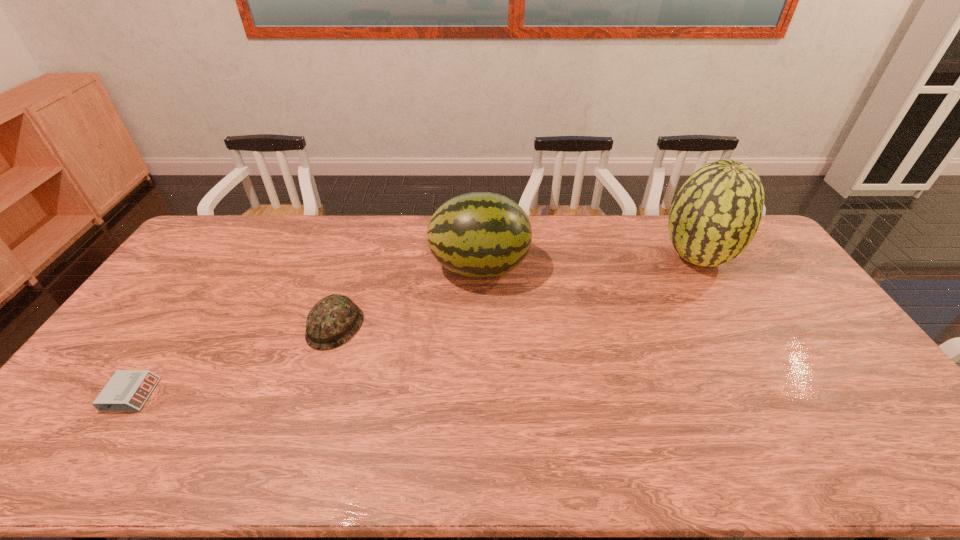
Where is `vacant space situated on the right of the headwear`? Image resolution: width=960 pixels, height=540 pixels. vacant space situated on the right of the headwear is located at coordinates tap(439, 327).

Where is `vacant space positioned 0.240m on the back of the leftmost object`? This screenshot has width=960, height=540. vacant space positioned 0.240m on the back of the leftmost object is located at coordinates (186, 313).

You are a GUI agent. You are given a task and a screenshot of the screen. Output one action in this format:
    pyautogui.click(x=<x>, y=<y>)
    Task: Click on the object that is at the left edge
    Image resolution: width=960 pixels, height=540 pixels.
    Given the screenshot: What is the action you would take?
    pyautogui.click(x=127, y=390)

The width and height of the screenshot is (960, 540). In order to click on object located in the right edge section of the desktop in this screenshot , I will do pyautogui.click(x=716, y=213).

Where is `object that is positioned at the far right corner`? The width and height of the screenshot is (960, 540). object that is positioned at the far right corner is located at coordinates (716, 213).

Image resolution: width=960 pixels, height=540 pixels. What are the coordinates of `free location at the far edge of the desktop` in the screenshot? It's located at (597, 228).

Locate an element on the screen. This screenshot has width=960, height=540. vacant area at the near edge of the desktop is located at coordinates (487, 438).

This screenshot has height=540, width=960. In order to click on free space at the left edge of the desktop in this screenshot , I will do `click(61, 429)`.

You are a GUI agent. You are given a task and a screenshot of the screen. Output one action in this format:
    pyautogui.click(x=<x>, y=<y>)
    Task: Click on the vacant point at the right edge
    This screenshot has width=960, height=540.
    Given the screenshot: What is the action you would take?
    coord(769,266)

At what (x,y) coordinates should I click in order to perform the action: click on vacant space that's between the third tallest object and the leftmost object. Please return your answer as a coordinate pair (x, y). The image size is (960, 540). Looking at the image, I should click on (233, 361).